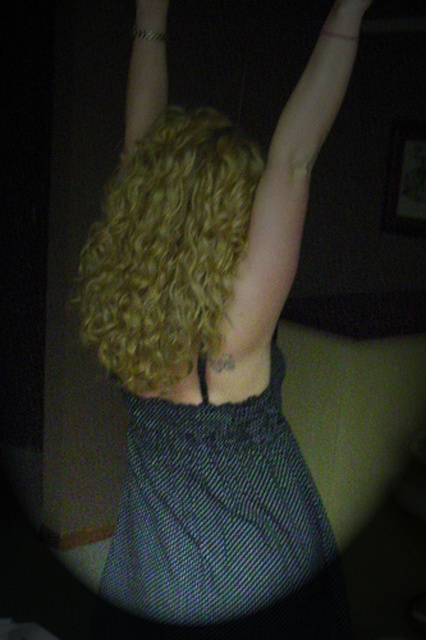
You are a photographer adjusting the focus on your camera. You need to capture both the curly blonde hair at center and the matte black hand at upper center in sharp focus. The camera can only focus on objects within a 15 inch range. Will both objects be in focus?

The distance between the curly blonde hair at center and the matte black hand at upper center is 18.22 inches, which exceeds the camera focus range of 15 inches. Therefore, both objects cannot be in sharp focus simultaneously.

Based on the photo, you are a photographer setting up a shoot in a dimly lit room. You notice the textured black dress at center and the matte black hand at upper center. Based on their positions, which object is closer to the camera?

The matte black hand at upper center is closer to the camera because it is positioned above and in front of the textured black dress at center.